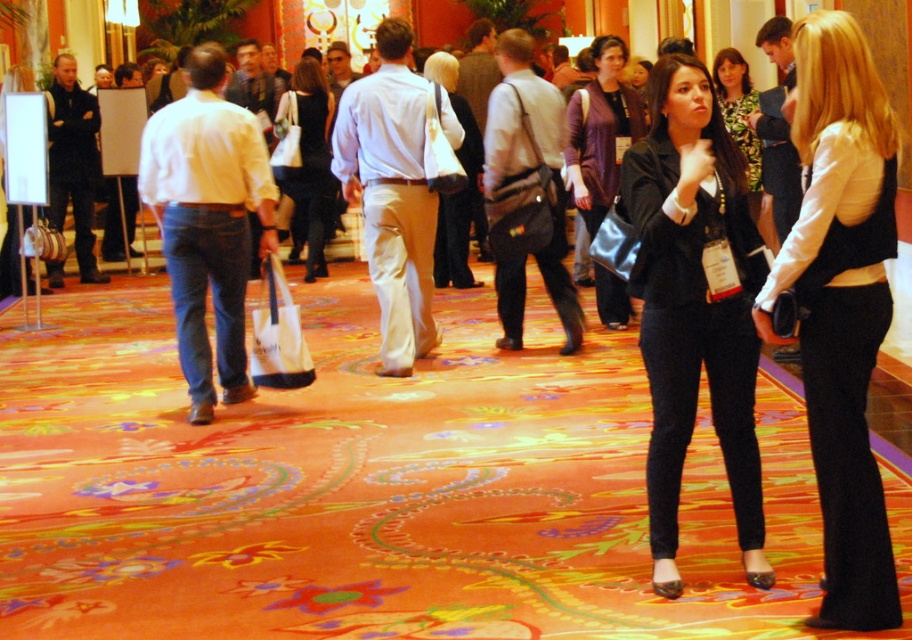
How far apart are black textured blazer at center and green floral dress at center?

The distance of black textured blazer at center from green floral dress at center is 4.07 meters.

Does black textured blazer at center have a greater height compared to green floral dress at center?

Yes, black textured blazer at center is taller than green floral dress at center.

Between point (653, 452) and point (744, 145), which one is positioned in front?

Positioned in front is point (653, 452).

In order to click on black textured blazer at center in this screenshot , I will do tap(695, 305).

Looking at this image, who is shorter, purple matte cardigan at center or green floral dress at center?

Standing shorter between the two is green floral dress at center.

Which is more to the right, purple matte cardigan at center or green floral dress at center?

green floral dress at center

Between point (588, 96) and point (748, 129), which one is positioned in front?

Positioned in front is point (748, 129).

Locate an element on the screen. purple matte cardigan at center is located at coordinates (600, 131).

Does matte white bag at center have a lesser width compared to green floral dress at center?

Yes.

From the picture: Is matte white bag at center to the left of green floral dress at center from the viewer's perspective?

Indeed, matte white bag at center is positioned on the left side of green floral dress at center.

From the picture: Who is more forward, (457, 282) or (744, 74)?

Positioned in front is point (744, 74).

At what (x,y) coordinates should I click in order to perform the action: click on matte white bag at center. Please return your answer as a coordinate pair (x, y). This screenshot has height=640, width=912. Looking at the image, I should click on (459, 189).